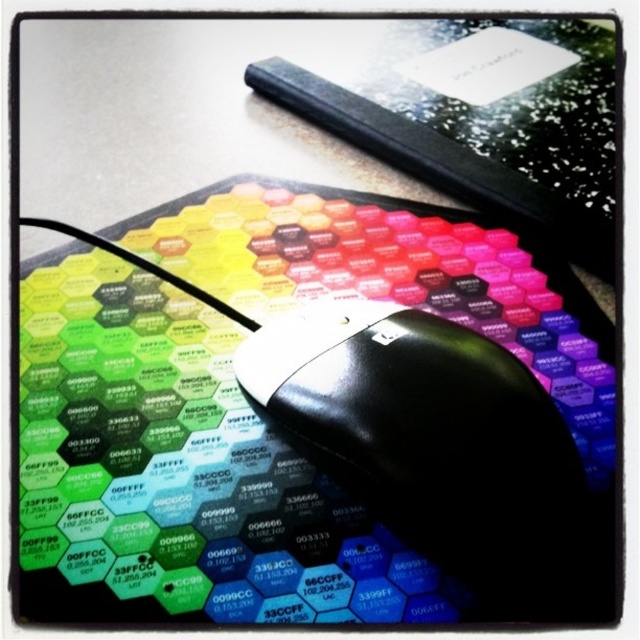
Which of these two, hexagonal patterned mousepad at center or black plastic mouse at center, stands shorter?

black plastic mouse at center is shorter.

Is point (365, 196) closer to viewer compared to point (468, 515)?

That is False.

Is point (195, 602) closer to viewer compared to point (572, 493)?

No, it is not.

At what (x,y) coordinates should I click in order to perform the action: click on hexagonal patterned mousepad at center. Please return your answer as a coordinate pair (x, y). The width and height of the screenshot is (640, 640). Looking at the image, I should click on (179, 474).